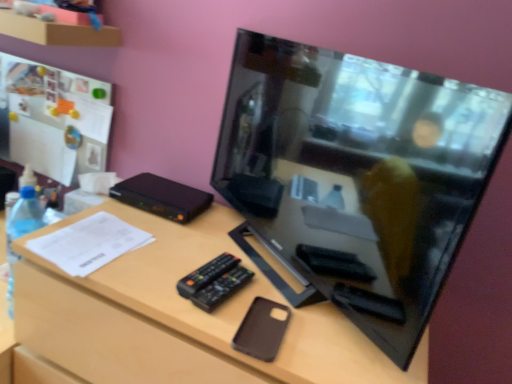
Question: Which is correct: black glossy television at center is inside black plastic remote at center, or outside of it?

Choices:
 (A) outside
 (B) inside

Answer: (A)

Question: Considering the positions of black glossy television at center and black plastic remote at center in the image, is black glossy television at center bigger or smaller than black plastic remote at center?

Choices:
 (A) big
 (B) small

Answer: (A)

Question: Which of these objects is positioned farthest from the clear plastic bottle at left?

Choices:
 (A) brown matte phone case at center
 (B) black plastic remote at center
 (C) black plastic remote at center
 (D) black glossy television at center
 (E) brown matte phone case at center

Answer: (D)

Question: Which object is positioned closest to the black glossy television at center?

Choices:
 (A) black plastic remote at center
 (B) brown matte phone case at center
 (C) brown matte phone case at center
 (D) black plastic remote at center
 (E) clear plastic bottle at left

Answer: (C)